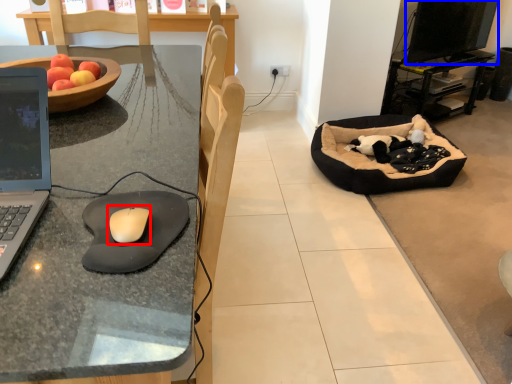
Question: Which object appears closest to the camera in this image, mouse (highlighted by a red box) or computer monitor (highlighted by a blue box)?

Choices:
 (A) mouse
 (B) computer monitor

Answer: (A)